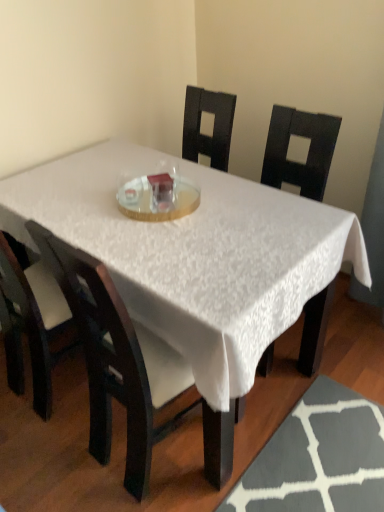
Question: Is the position of matte black chair at center, positioned as the 2th chair in right-to-left order, more distant than that of matte black chair at center, the first chair when ordered from right to left?

Choices:
 (A) no
 (B) yes

Answer: (B)

Question: Is matte black chair at center, the first chair when ordered from right to left, at the back of matte black chair at center, positioned as the 2th chair in right-to-left order?

Choices:
 (A) yes
 (B) no

Answer: (B)

Question: Is matte black chair at center, which is the 1th chair from left to right, bigger than matte black chair at center, acting as the 2th chair starting from the left?

Choices:
 (A) yes
 (B) no

Answer: (B)

Question: Does matte black chair at center, positioned as the 2th chair in right-to-left order, have a greater height compared to matte black chair at center, the first chair when ordered from right to left?

Choices:
 (A) yes
 (B) no

Answer: (B)

Question: Is matte black chair at center, positioned as the 2th chair in right-to-left order, positioned in front of matte black chair at center, acting as the 2th chair starting from the left?

Choices:
 (A) yes
 (B) no

Answer: (B)

Question: Looking at their shapes, would you say clear glass plate at center is wider or thinner than white textured table at center?

Choices:
 (A) wide
 (B) thin

Answer: (B)

Question: Is point (170, 193) closer or farther from the camera than point (43, 202)?

Choices:
 (A) farther
 (B) closer

Answer: (B)

Question: Is clear glass plate at center inside or outside of white textured table at center?

Choices:
 (A) inside
 (B) outside

Answer: (A)

Question: Considering the relative positions of clear glass plate at center and white textured table at center in the image provided, is clear glass plate at center to the left or to the right of white textured table at center?

Choices:
 (A) right
 (B) left

Answer: (B)

Question: Would you say matte black chair at center, which is the 1th chair from left to right, is to the left or to the right of matte black chair at center, the first chair when ordered from right to left, in the picture?

Choices:
 (A) right
 (B) left

Answer: (B)

Question: In terms of width, does matte black chair at center, positioned as the 2th chair in right-to-left order, look wider or thinner when compared to matte black chair at center, the first chair when ordered from right to left?

Choices:
 (A) wide
 (B) thin

Answer: (B)

Question: From their relative heights in the image, would you say matte black chair at center, which is the 1th chair from left to right, is taller or shorter than matte black chair at center, acting as the 2th chair starting from the left?

Choices:
 (A) short
 (B) tall

Answer: (A)

Question: Is matte black chair at center, which is the 1th chair from left to right, situated inside matte black chair at center, acting as the 2th chair starting from the left, or outside?

Choices:
 (A) outside
 (B) inside

Answer: (A)

Question: Considering the relative positions of matte black chair at center, positioned as the 2th chair in right-to-left order, and white textured table at center in the image provided, is matte black chair at center, positioned as the 2th chair in right-to-left order, to the left or to the right of white textured table at center?

Choices:
 (A) left
 (B) right

Answer: (A)

Question: In terms of height, does matte black chair at center, positioned as the 2th chair in right-to-left order, look taller or shorter compared to white textured table at center?

Choices:
 (A) tall
 (B) short

Answer: (A)